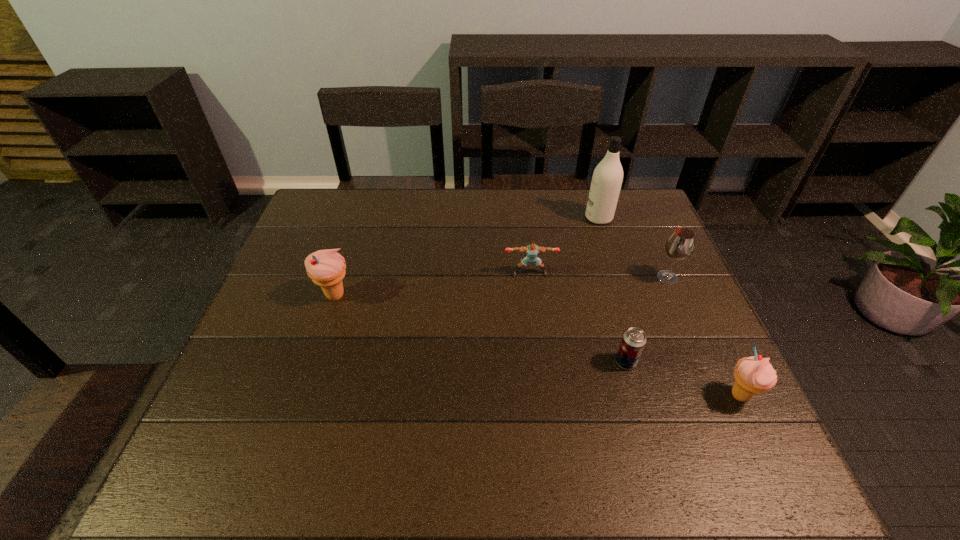
Locate an element on the screen. This screenshot has height=540, width=960. the taller icecream is located at coordinates (326, 268).

Find the location of a particular element. the leftmost object is located at coordinates (326, 268).

The height and width of the screenshot is (540, 960). Identify the location of the nearest object. (754, 374).

Locate an element on the screen. the shorter icecream is located at coordinates (754, 374).

Locate an element on the screen. puncher is located at coordinates (532, 250).

This screenshot has width=960, height=540. I want to click on wineglass, so click(680, 245).

I want to click on the tallest object, so click(607, 178).

What are the coordinates of `shampoo` in the screenshot? It's located at (607, 178).

Image resolution: width=960 pixels, height=540 pixels. I want to click on the fifth farthest object, so (633, 341).

This screenshot has width=960, height=540. I want to click on vacant space located on the front of the leftmost object, so click(x=325, y=327).